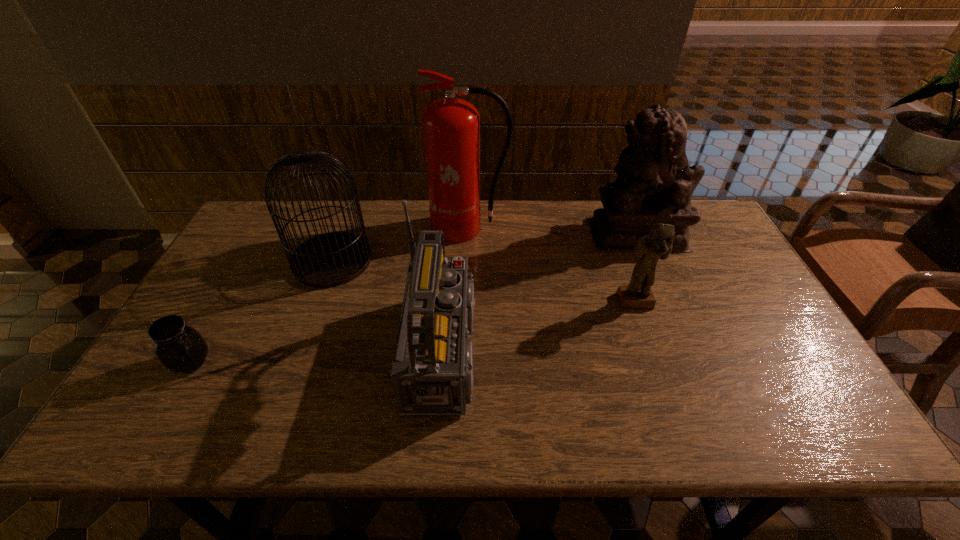
Locate an element on the screen. This screenshot has height=540, width=960. the tallest object is located at coordinates (451, 126).

In order to click on sculpture in this screenshot , I will do `click(655, 183)`.

Image resolution: width=960 pixels, height=540 pixels. I want to click on the fifth object from right to left, so click(331, 259).

I want to click on radio receiver, so click(432, 371).

Where is `figurine`? The height and width of the screenshot is (540, 960). figurine is located at coordinates (657, 245).

Where is `jar`? The image size is (960, 540). jar is located at coordinates [180, 348].

The width and height of the screenshot is (960, 540). I want to click on the leftmost object, so click(x=180, y=348).

I want to click on free space located towards the nozzle of the fire extinguisher, so click(x=468, y=265).

The width and height of the screenshot is (960, 540). In order to click on free space located 0.270m on the front-facing side of the sculpture in this screenshot , I will do `click(509, 234)`.

At what (x,y) coordinates should I click in order to perform the action: click on vacant area situated on the front-facing side of the sculpture. Please return your answer as a coordinate pair (x, y). Image resolution: width=960 pixels, height=540 pixels. Looking at the image, I should click on (524, 234).